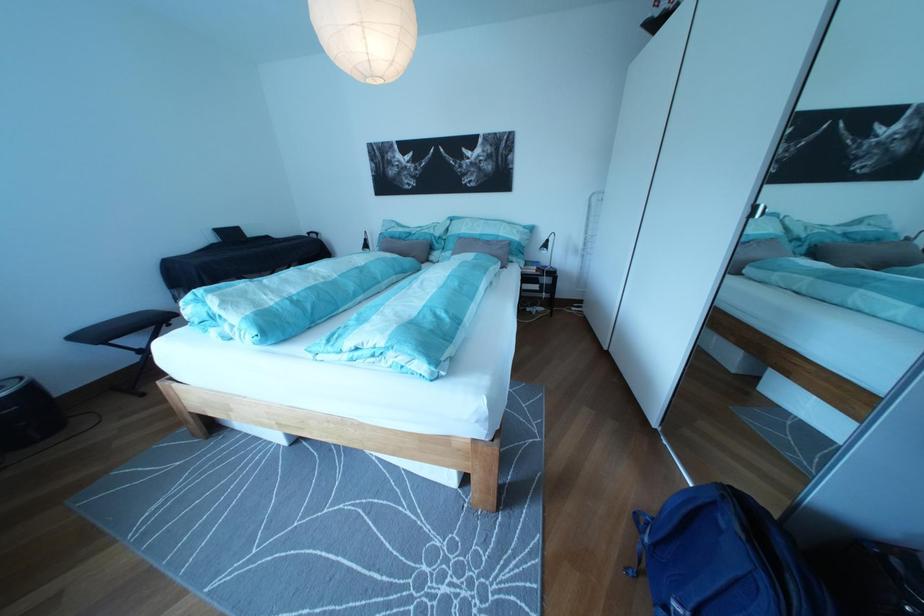
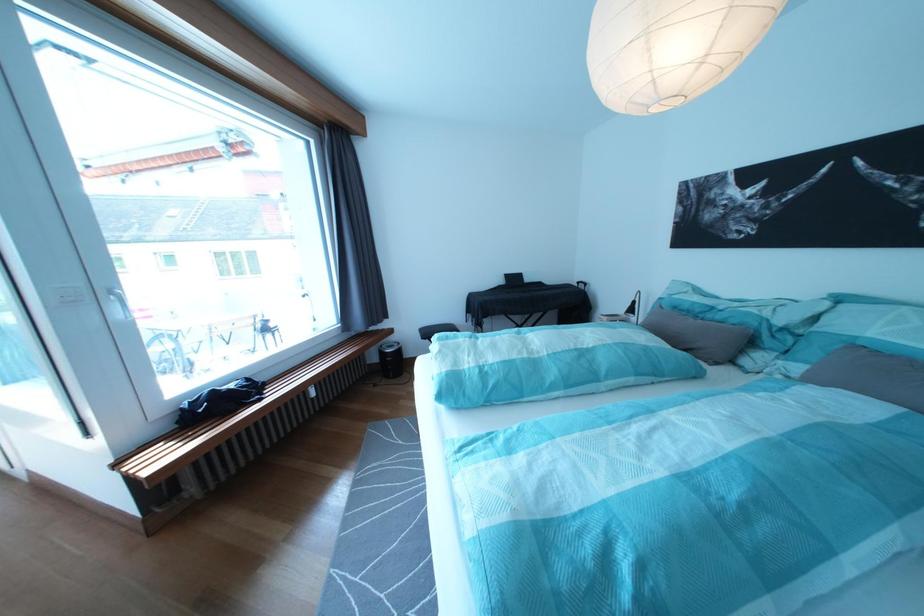
The point at (x=465, y=251) is marked in the first image. Where is the corresponding point in the second image?

(825, 358)